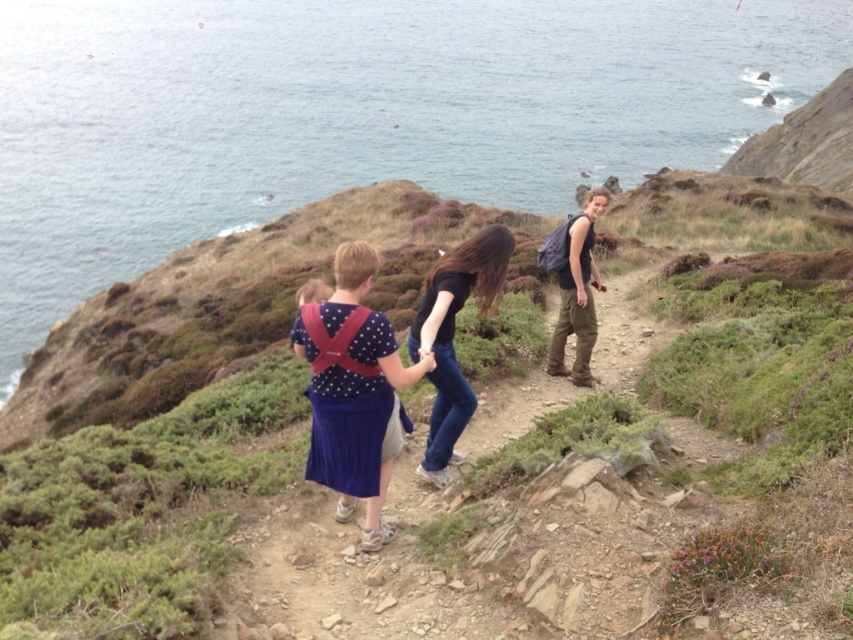
Question: Which of the following is the farthest from the observer?

Choices:
 (A) matte blue dress at center
 (B) dark brown leather pants at right

Answer: (B)

Question: Which of the following is the closest to the observer?

Choices:
 (A) tap(579, 381)
 (B) tap(433, 316)
 (C) tap(39, 122)

Answer: (B)

Question: Does polka dot fabric baby carrier at center come behind polka dot fabric dress at center?

Choices:
 (A) yes
 (B) no

Answer: (B)

Question: Is polka dot fabric baby carrier at center smaller than dark brown leather pants at right?

Choices:
 (A) no
 (B) yes

Answer: (B)

Question: Which of the following is the farthest from the observer?

Choices:
 (A) blue water at upper left
 (B) dark brown leather pants at right
 (C) black matte shirt at center
 (D) matte blue dress at center

Answer: (A)

Question: Observing the image, what is the correct spatial positioning of blue water at upper left in reference to black matte shirt at center?

Choices:
 (A) below
 (B) above

Answer: (B)